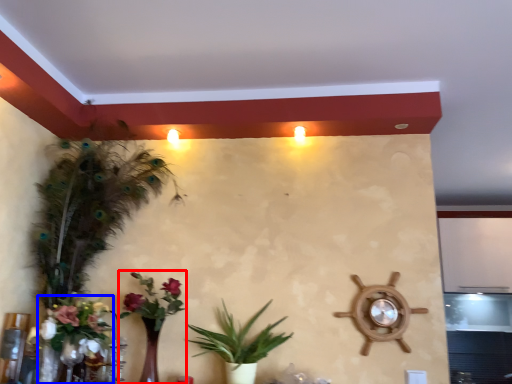
Question: Which object appears farthest to the camera in this image, floral arrangement (highlighted by a red box) or floral arrangement (highlighted by a blue box)?

Choices:
 (A) floral arrangement
 (B) floral arrangement

Answer: (A)